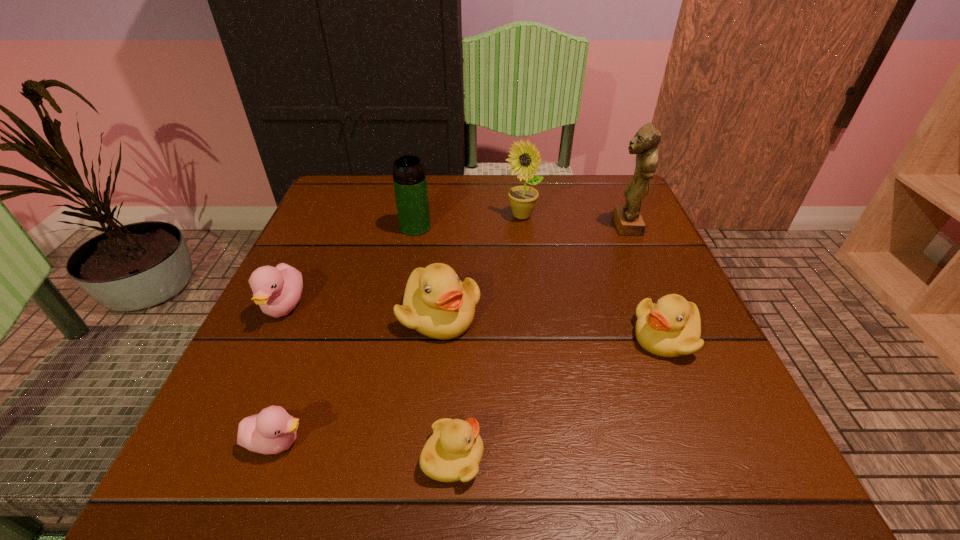
Locate an element on the screen. The image size is (960, 540). free space located on the front-facing side of the smaller pink duckling is located at coordinates (544, 442).

Locate an element on the screen. Image resolution: width=960 pixels, height=540 pixels. vacant space located on the front-facing side of the smallest yellow duckling is located at coordinates (717, 457).

In order to click on figurine located in the far edge section of the desktop in this screenshot , I will do `click(628, 220)`.

Identify the location of thermos bottle located in the far edge section of the desktop. (410, 185).

I want to click on sunflower positioned at the far edge, so click(x=525, y=158).

Image resolution: width=960 pixels, height=540 pixels. I want to click on figurine that is at the right edge, so click(x=628, y=220).

The width and height of the screenshot is (960, 540). I want to click on duckling that is at the right edge, so click(671, 327).

Where is `object at the near left corner`? The height and width of the screenshot is (540, 960). object at the near left corner is located at coordinates (273, 430).

Where is `object that is at the far right corner`? Image resolution: width=960 pixels, height=540 pixels. object that is at the far right corner is located at coordinates (628, 220).

The height and width of the screenshot is (540, 960). I want to click on vacant space at the far edge, so point(558,205).